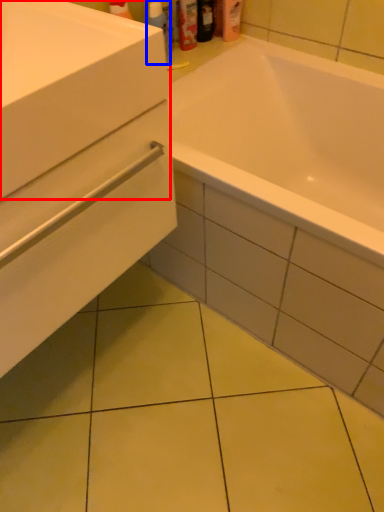
Question: Which of the following is the farthest to the observer, sink (highlighted by a red box) or cleaning product (highlighted by a blue box)?

Choices:
 (A) sink
 (B) cleaning product

Answer: (B)